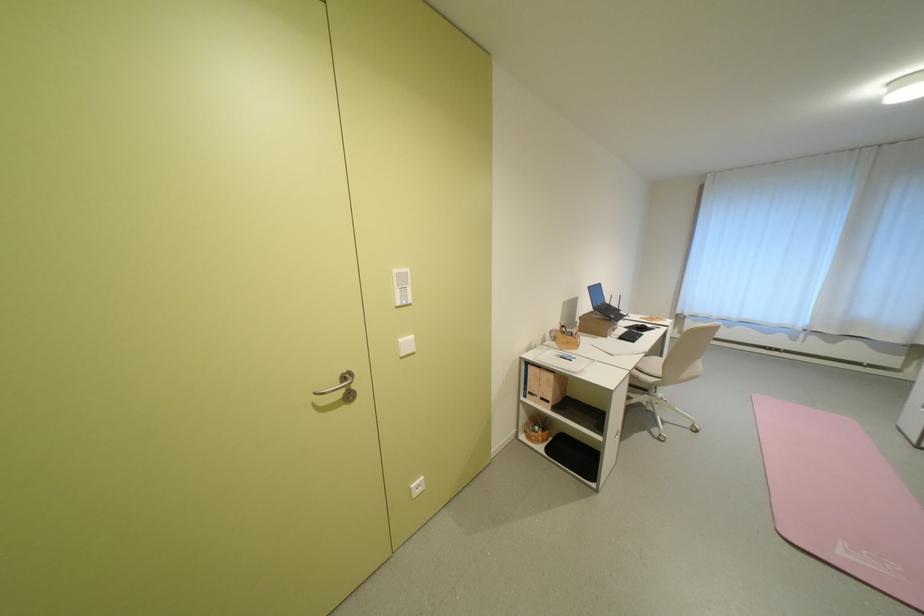
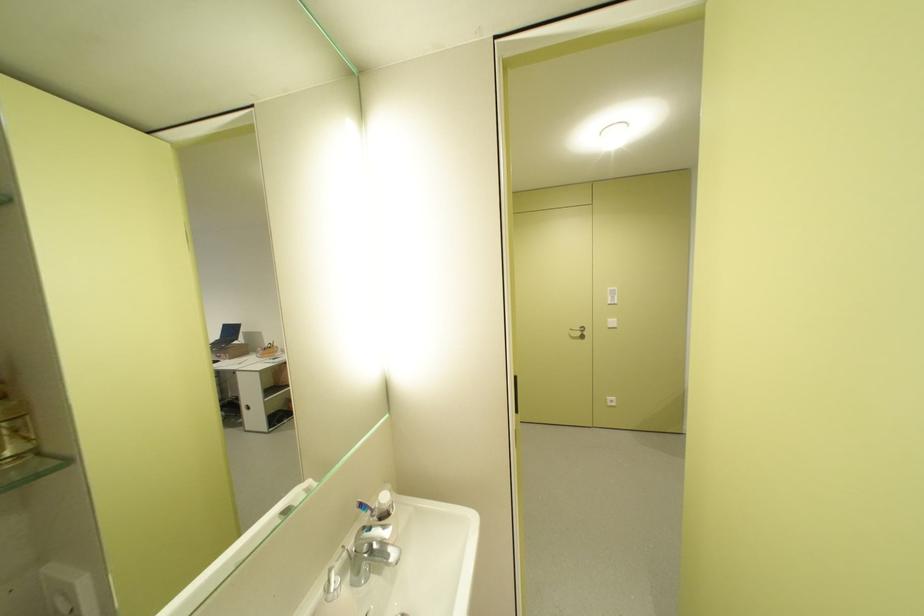
Locate, in the second image, the point that corresponds to point (324, 395) in the first image.

(579, 331)